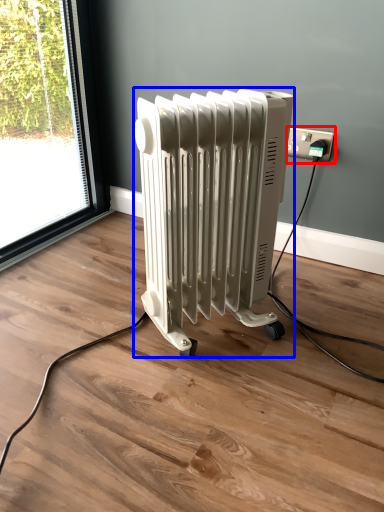
Question: Which point is closer to the camera, power plugs and sockets (highlighted by a red box) or radiator (highlighted by a blue box)?

Choices:
 (A) power plugs and sockets
 (B) radiator

Answer: (B)